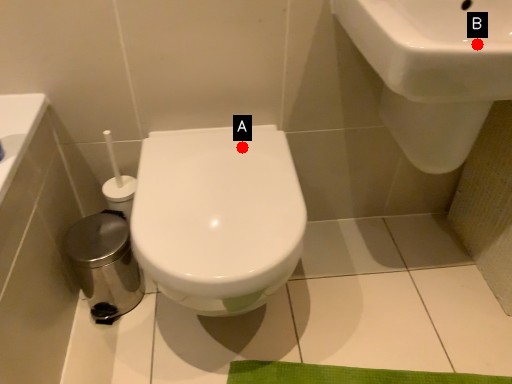
Question: Two points are circled on the image, labeled by A and B beside each circle. Among these points, which one is nearest to the camera?

Choices:
 (A) A is closer
 (B) B is closer

Answer: (B)